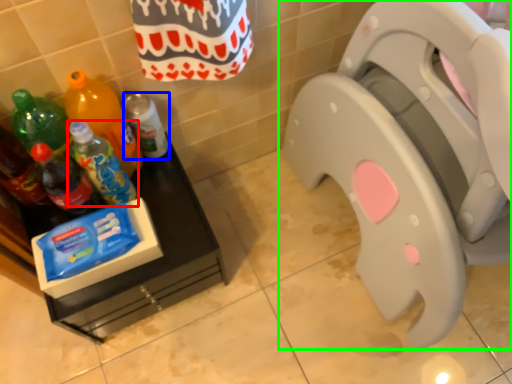
Question: Based on their relative distances, which object is nearer to bottle (highlighted by a red box)? Choose from bottle (highlighted by a blue box) and toilet (highlighted by a green box).

Choices:
 (A) bottle
 (B) toilet

Answer: (A)